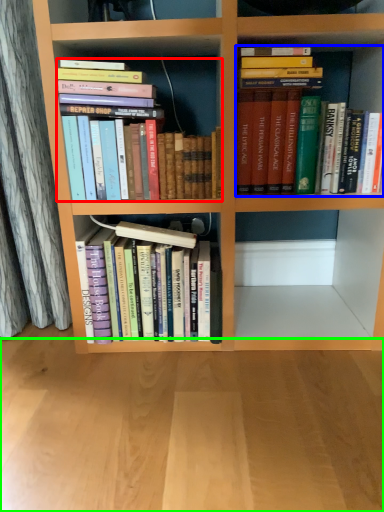
Question: Which object is positioned farthest from book (highlighted by a red box)? Select from book (highlighted by a blue box) and plain (highlighted by a green box).

Choices:
 (A) book
 (B) plain

Answer: (B)